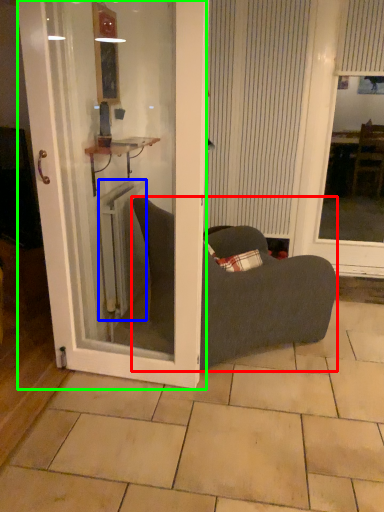
Question: Based on their relative distances, which object is farther from chair (highlighted by a red box)? Choose from radiator (highlighted by a blue box) and door (highlighted by a green box).

Choices:
 (A) radiator
 (B) door

Answer: (A)